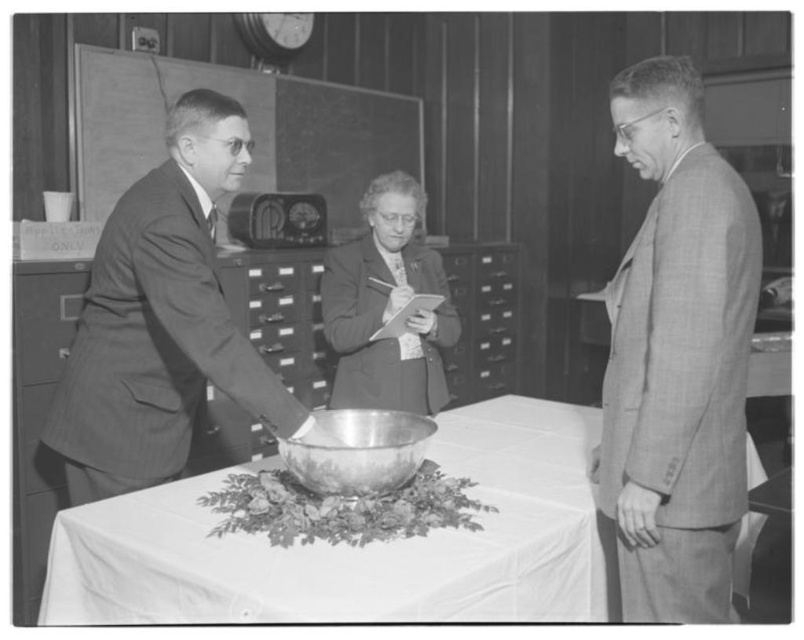
The height and width of the screenshot is (640, 804). What are the coordinates of `checkered wool suit at right` in the screenshot? It's located at 675,356.

Which is behind, point (667, 81) or point (355, 417)?

Positioned behind is point (355, 417).

Find the location of `checkered wool suit at right`. checkered wool suit at right is located at coordinates (675, 356).

In the scene shown: Between checkered wool suit at right and matte black suit at center, which one is positioned lower?

checkered wool suit at right is below.

Which is more to the left, checkered wool suit at right or matte black suit at center?

From the viewer's perspective, matte black suit at center appears more on the left side.

Which is behind, point (708, 596) or point (386, 356)?

Point (386, 356)

I want to click on checkered wool suit at right, so click(675, 356).

Does point (339, 550) come in front of point (171, 294)?

Yes, it is.

Locate an element on the screen. white cloth at center is located at coordinates (357, 547).